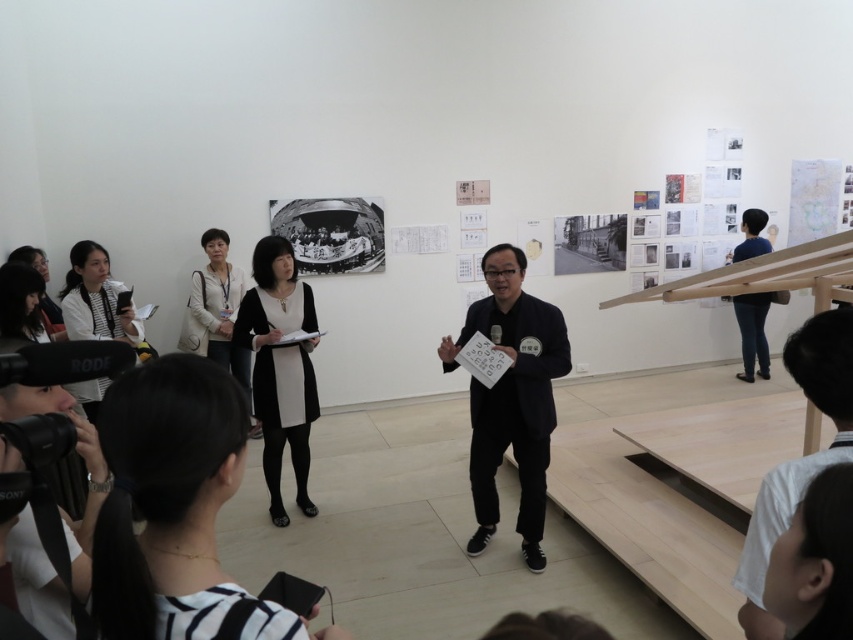
Question: Can you confirm if black matte suit at center is bigger than blue jeans at right?

Choices:
 (A) yes
 (B) no

Answer: (A)

Question: Which object is positioned closest to the white matte shirt at left?

Choices:
 (A) black matte suit at center
 (B) black matte shirt at center
 (C) light beige sweater at center
 (D) black matte dress at center

Answer: (C)

Question: Can you confirm if black matte dress at lower left is thinner than white fabric at lower right?

Choices:
 (A) yes
 (B) no

Answer: (B)

Question: Which point is closer to the camera?

Choices:
 (A) black matte suit at center
 (B) blue jeans at right

Answer: (A)

Question: Is white fabric at lower right below blue jeans at right?

Choices:
 (A) no
 (B) yes

Answer: (B)

Question: Which object appears closest to the camera in this image?

Choices:
 (A) blue jeans at right
 (B) white fabric at lower right
 (C) white matte shirt at left

Answer: (B)